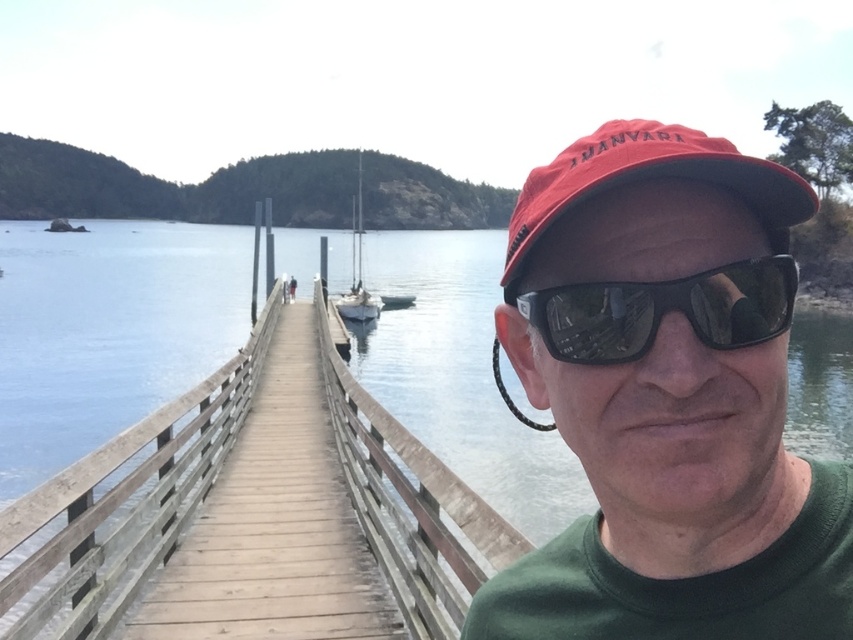
Is matte red cap at center further to the viewer compared to wooden at center?

That is False.

Does matte red cap at center have a smaller size compared to wooden at center?

Indeed, matte red cap at center has a smaller size compared to wooden at center.

Between point (602, 586) and point (62, 504), which one is positioned behind?

The point (62, 504) is more distant.

This screenshot has height=640, width=853. I want to click on matte red cap at center, so click(x=666, y=397).

Measure the distance between matte red cap at center and camera.

The distance of matte red cap at center from camera is 29.42 inches.

Does matte red cap at center have a lesser width compared to white matte sailboat at center?

Yes.

Which is behind, point (508, 339) or point (361, 182)?

The point (361, 182) is more distant.

This screenshot has height=640, width=853. In order to click on matte red cap at center in this screenshot , I will do `click(666, 397)`.

Is wooden at center wider than white matte sailboat at center?

Incorrect, wooden at center's width does not surpass white matte sailboat at center's.

Is wooden at center positioned in front of white matte sailboat at center?

Yes, wooden at center is closer to the viewer.

The image size is (853, 640). Describe the element at coordinates (125, 506) in the screenshot. I see `wooden at center` at that location.

This screenshot has width=853, height=640. Identify the location of wooden at center. (125, 506).